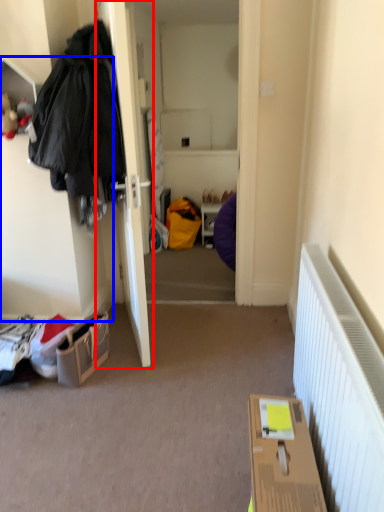
Question: Among these objects, which one is nearest to the camera, door (highlighted by a red box) or cabinetry (highlighted by a blue box)?

Choices:
 (A) door
 (B) cabinetry

Answer: (B)